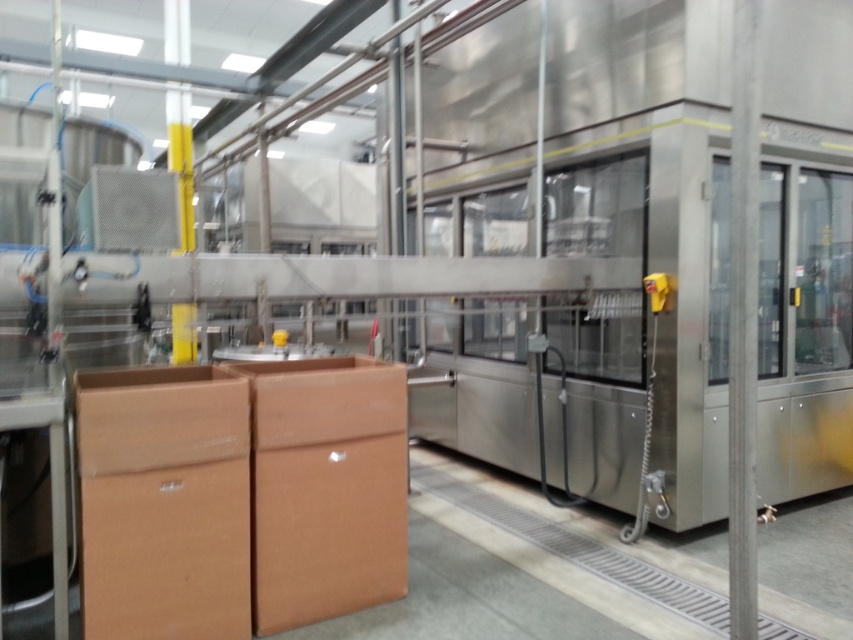
You are a maintenance worker in an industrial facility. You need to access the emergency stop button on the machine. There are two obstacles in your path. The brown cardboard box at left and the metallic silver sink at center. Which obstacle is closer to the emergency stop button?

The brown cardboard box at left is located below metallic silver sink at center, so the brown cardboard box at left is closer to the emergency stop button.

You are an inspector in the facility and need to locate the brown cardboard box at left. According to the coordinates given, where would you find it in the image?

The brown cardboard box at left is located at the 2D coordinates point (x=164, y=502) in the image.